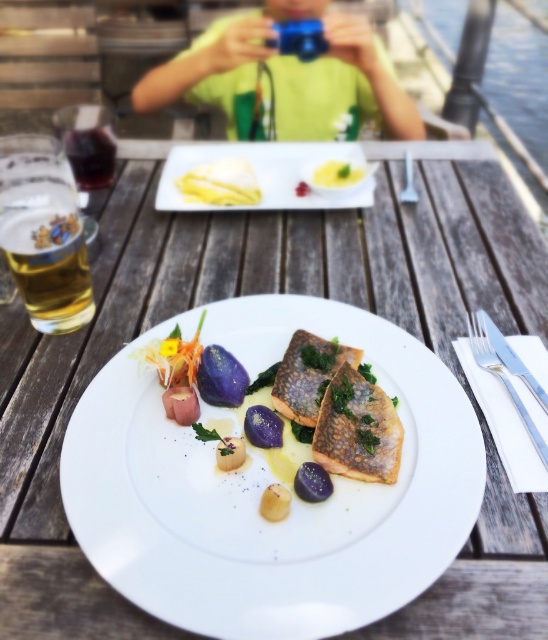
Between point (369, 376) and point (214, 163), which one is positioned in front?

Point (369, 376)

Is smooth golden fish at center thinner than yellow creamy cheese at upper center?

In fact, smooth golden fish at center might be wider than yellow creamy cheese at upper center.

The image size is (548, 640). Describe the element at coordinates (305, 403) in the screenshot. I see `smooth golden fish at center` at that location.

Identify the location of smooth golden fish at center. The height and width of the screenshot is (640, 548). (305, 403).

Is point (470, 496) positioned behind point (99, 132)?

No, it is not.

Can you confirm if white porcelain plate at center is positioned above dark red glass at left?

No.

Is point (219, 317) in front of point (85, 166)?

Yes, point (219, 317) is closer to viewer.

Locate an element on the screen. The width and height of the screenshot is (548, 640). white porcelain plate at center is located at coordinates (265, 486).

From the picture: Is green matte shirt at upper center closer to the viewer compared to dark red glass at left?

No.

Consider the image. Between green matte shirt at upper center and dark red glass at left, which one appears on the left side from the viewer's perspective?

dark red glass at left is more to the left.

Describe the element at coordinates (286, 77) in the screenshot. I see `green matte shirt at upper center` at that location.

In order to click on green matte shirt at upper center in this screenshot , I will do `click(286, 77)`.